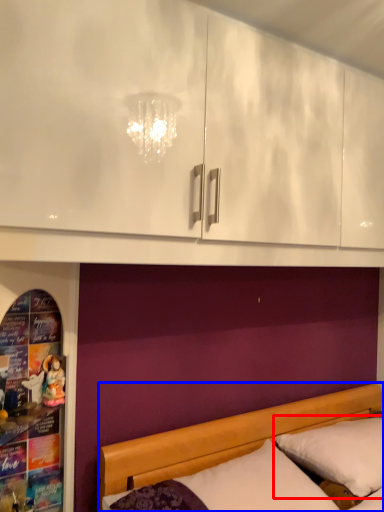
Question: Among these objects, which one is farthest to the camera, pillow (highlighted by a red box) or bed (highlighted by a blue box)?

Choices:
 (A) pillow
 (B) bed

Answer: (A)